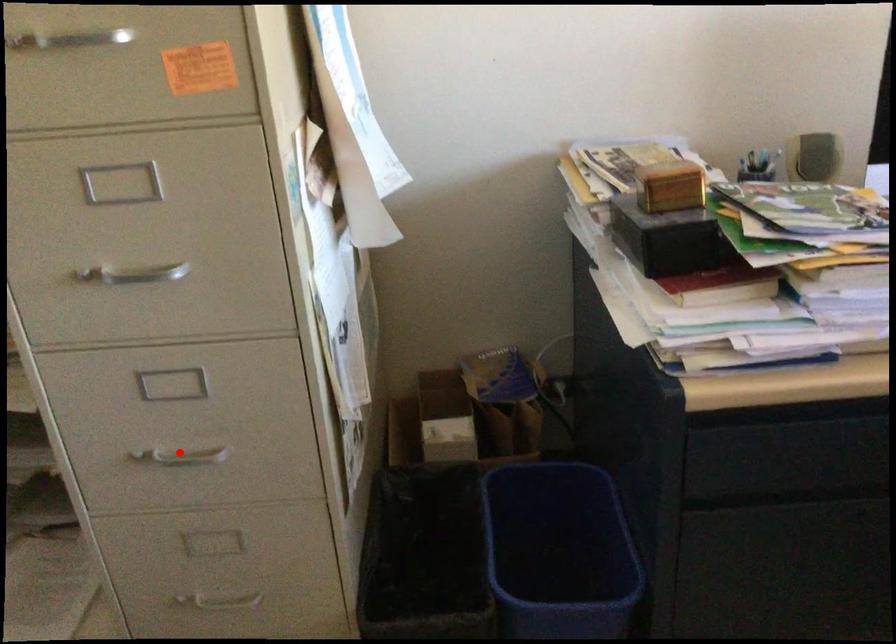
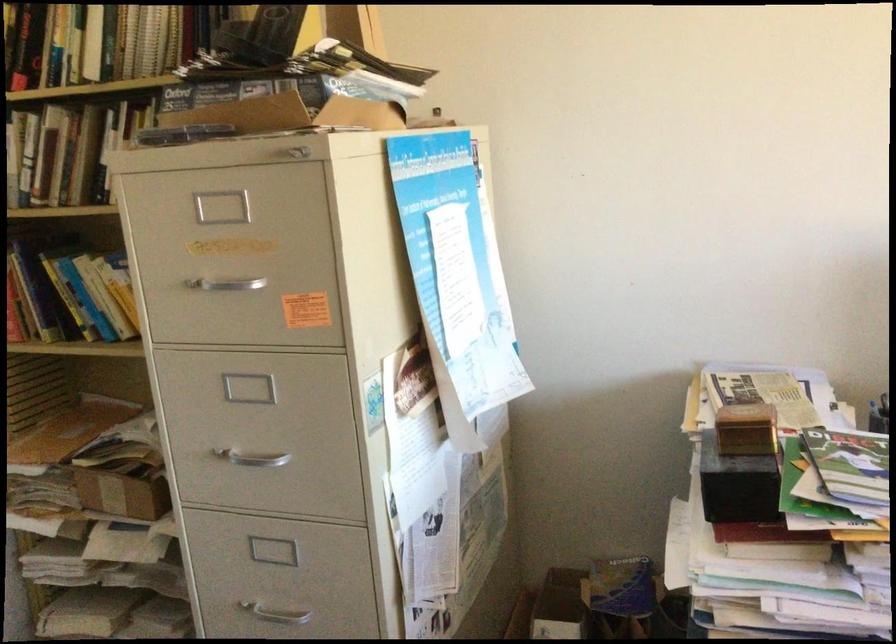
Question: A red point is marked in image1. In image2, is the corresponding 3D point closer to the camera or farther? Reply with the corresponding letter.

Choices:
 (A) The corresponding 3D point is closer.
 (B) The corresponding 3D point is farther.

Answer: (B)